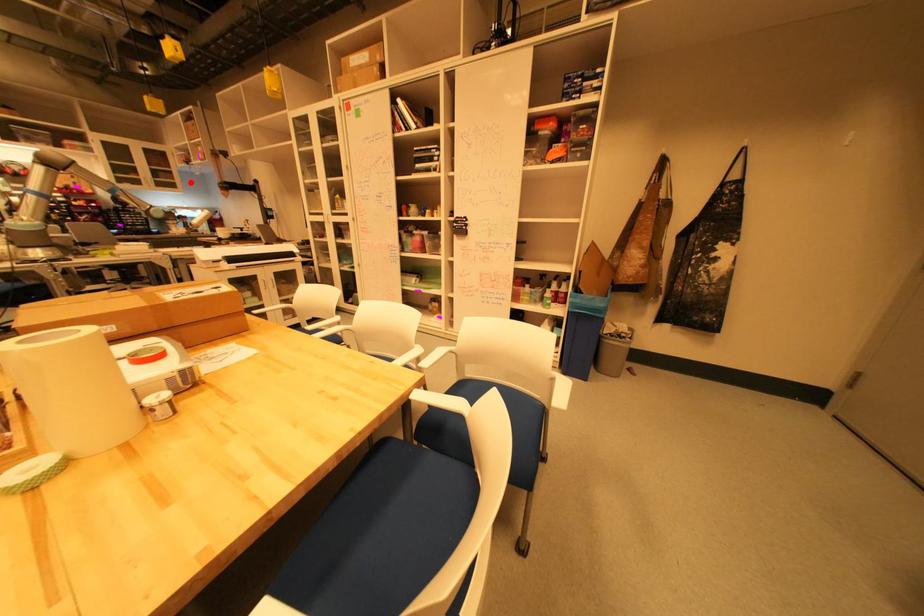
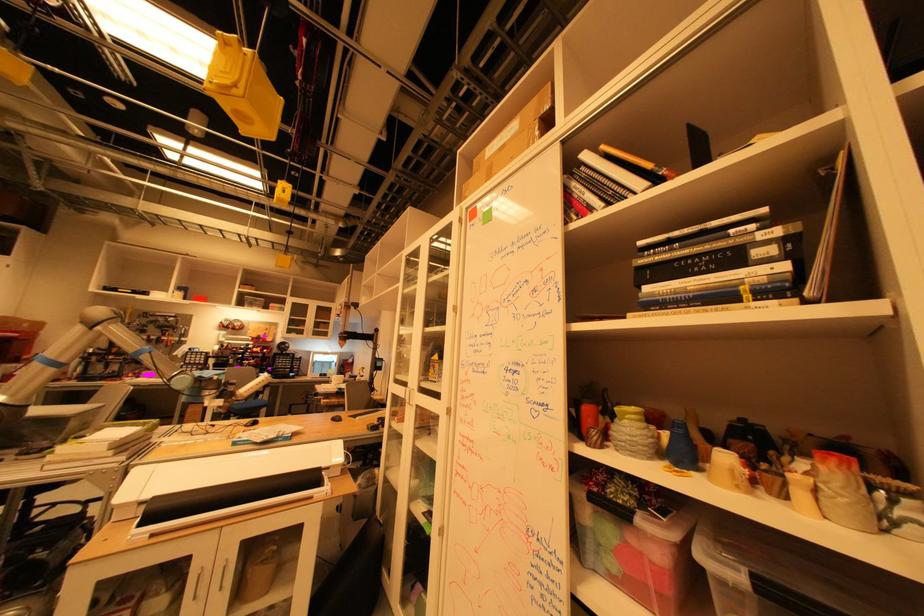
The point at the highlighted location is marked in the first image. Where is the corresponding point in the second image?

(343, 331)